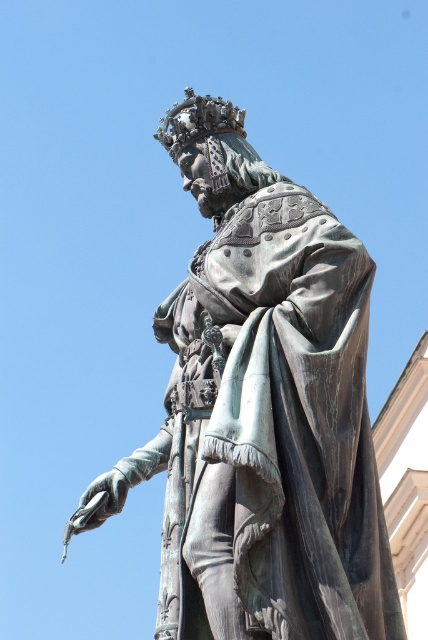
You are an art conservator assessing the statue. You need to determine if a protective covering designed for the bronze statue at center can also fit over the shiny gold crown at upper center. Based on their widths, will the covering fit the crown?

The bronze statue at center is wider than the shiny gold crown at upper center. Since the protective covering is designed for the statue, it may be too large to properly fit the crown, which is narrower in width.

You are a tour guide explaining the statue to visitors. Pointing to the bronze statue at center and the shiny gold crown at upper center, you want to clarify their positions. Which object is closer to the viewers perspective?

The bronze statue at center is closer to the viewers perspective than the shiny gold crown at upper center because it is in front of it.